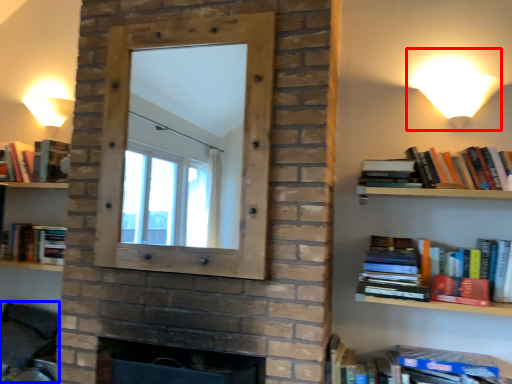
Question: Which point is further to the camera, table lamp (highlighted by a red box) or swivel chair (highlighted by a blue box)?

Choices:
 (A) table lamp
 (B) swivel chair

Answer: (B)